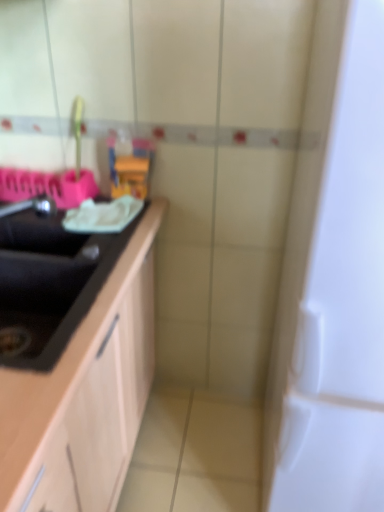
Question: From a real-world perspective, is black matte countertop at left below white glossy door at right?

Choices:
 (A) yes
 (B) no

Answer: (B)

Question: Considering the relative sizes of black matte countertop at left and white glossy door at right in the image provided, is black matte countertop at left bigger than white glossy door at right?

Choices:
 (A) yes
 (B) no

Answer: (B)

Question: From a real-world perspective, does black matte countertop at left stand above white glossy door at right?

Choices:
 (A) yes
 (B) no

Answer: (A)

Question: From the image's perspective, is black matte countertop at left located beneath white glossy door at right?

Choices:
 (A) yes
 (B) no

Answer: (B)

Question: Can you confirm if black matte countertop at left is positioned to the right of white glossy door at right?

Choices:
 (A) no
 (B) yes

Answer: (A)

Question: Does black matte countertop at left have a lesser height compared to white glossy door at right?

Choices:
 (A) yes
 (B) no

Answer: (A)

Question: Are black matte countertop at left and translucent plastic toy at center making contact?

Choices:
 (A) no
 (B) yes

Answer: (A)

Question: From a real-world perspective, is black matte countertop at left on top of translucent plastic toy at center?

Choices:
 (A) no
 (B) yes

Answer: (A)

Question: Does black matte countertop at left have a larger size compared to translucent plastic toy at center?

Choices:
 (A) no
 (B) yes

Answer: (B)

Question: Considering the relative sizes of black matte countertop at left and translucent plastic toy at center in the image provided, is black matte countertop at left taller than translucent plastic toy at center?

Choices:
 (A) yes
 (B) no

Answer: (A)

Question: Does black matte countertop at left have a smaller size compared to translucent plastic toy at center?

Choices:
 (A) no
 (B) yes

Answer: (A)

Question: Is black matte countertop at left thinner than translucent plastic toy at center?

Choices:
 (A) no
 (B) yes

Answer: (A)

Question: Does translucent plastic toy at center have a larger size compared to black matte countertop at left?

Choices:
 (A) yes
 (B) no

Answer: (B)